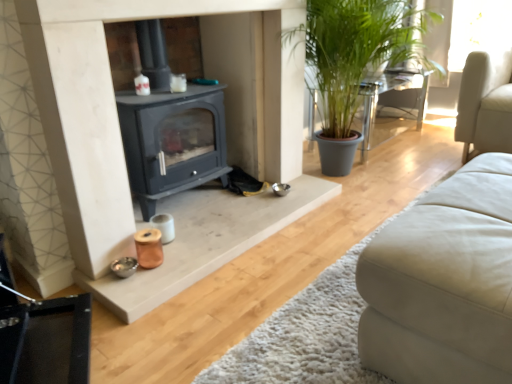
Question: From the image's perspective, does white leather studio couch at lower right appear higher than green leafy plant at right?

Choices:
 (A) yes
 (B) no

Answer: (B)

Question: Is white leather studio couch at lower right at the left side of green leafy plant at right?

Choices:
 (A) yes
 (B) no

Answer: (A)

Question: Considering the relative sizes of white leather studio couch at lower right and green leafy plant at right in the image provided, is white leather studio couch at lower right thinner than green leafy plant at right?

Choices:
 (A) yes
 (B) no

Answer: (B)

Question: Is white leather studio couch at lower right at the right side of green leafy plant at right?

Choices:
 (A) yes
 (B) no

Answer: (B)

Question: Is white leather studio couch at lower right positioned beyond the bounds of green leafy plant at right?

Choices:
 (A) no
 (B) yes

Answer: (B)

Question: Is white leather studio couch at lower right far from green leafy plant at right?

Choices:
 (A) no
 (B) yes

Answer: (B)

Question: Is green leafy plant at right at the right side of white leather studio couch at lower right?

Choices:
 (A) yes
 (B) no

Answer: (A)

Question: Is green leafy plant at right shorter than white leather studio couch at lower right?

Choices:
 (A) no
 (B) yes

Answer: (A)

Question: From a real-world perspective, does green leafy plant at right stand above white leather studio couch at lower right?

Choices:
 (A) yes
 (B) no

Answer: (B)

Question: Considering the relative sizes of green leafy plant at right and white leather studio couch at lower right in the image provided, is green leafy plant at right taller than white leather studio couch at lower right?

Choices:
 (A) yes
 (B) no

Answer: (A)

Question: Considering the relative positions of green leafy plant at right and white leather studio couch at lower right in the image provided, is green leafy plant at right to the left of white leather studio couch at lower right from the viewer's perspective?

Choices:
 (A) yes
 (B) no

Answer: (B)

Question: Is green leafy plant at right thinner than white leather studio couch at lower right?

Choices:
 (A) no
 (B) yes

Answer: (B)

Question: Looking at the image, does green leafy plant at right seem bigger or smaller compared to white leather studio couch at lower right?

Choices:
 (A) small
 (B) big

Answer: (B)